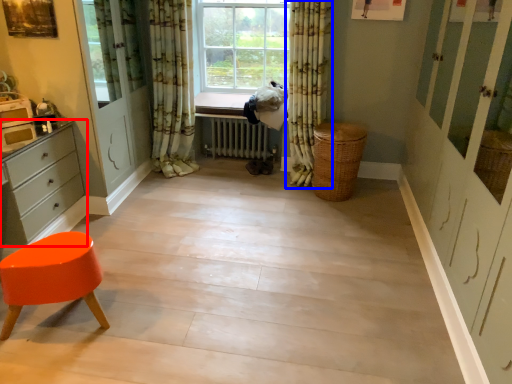
Question: Among these objects, which one is farthest to the camera, chest of drawers (highlighted by a red box) or curtain (highlighted by a blue box)?

Choices:
 (A) chest of drawers
 (B) curtain

Answer: (B)